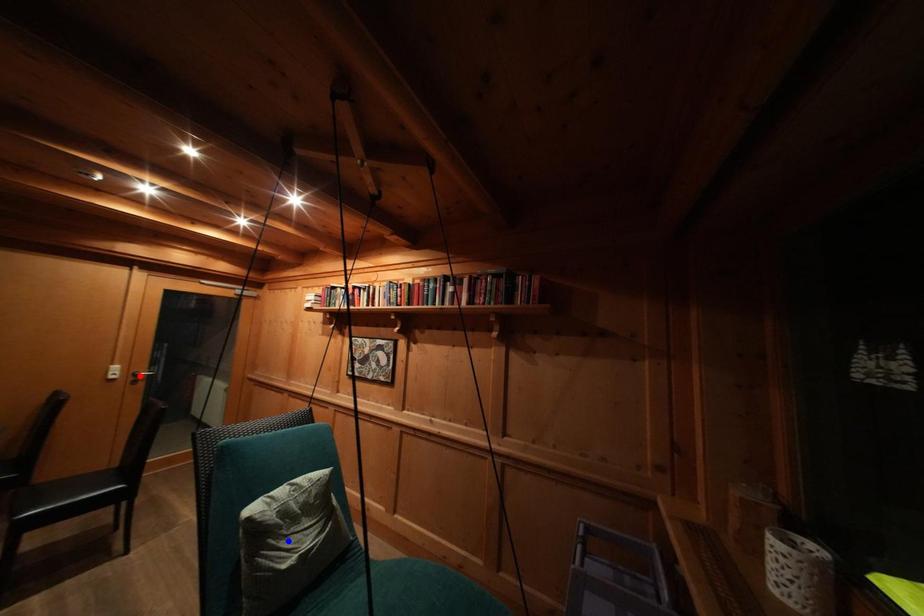
Question: Two points are marked on the image. Which point is closer to the camera?

Choices:
 (A) Blue point is closer.
 (B) Red point is closer.

Answer: (A)